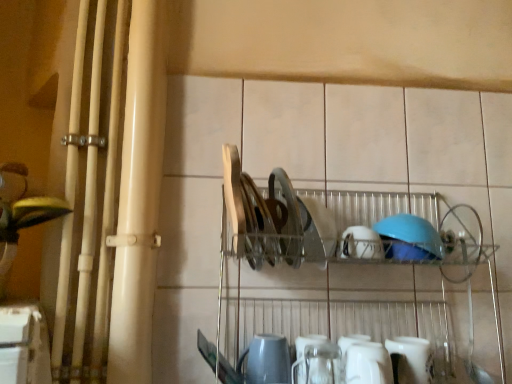
Question: From a real-world perspective, is white matte bowl at center, the second tableware when ordered from right to left, over metallic silver dish rack at center?

Choices:
 (A) no
 (B) yes

Answer: (B)

Question: Is white matte bowl at center, acting as the 4th tableware starting from the bottom, taller than metallic silver dish rack at center?

Choices:
 (A) no
 (B) yes

Answer: (A)

Question: Is metallic silver dish rack at center surrounded by white matte bowl at center, the second tableware when ordered from right to left?

Choices:
 (A) no
 (B) yes

Answer: (A)

Question: Considering the relative positions of white matte bowl at center, acting as the 4th tableware starting from the bottom, and metallic silver dish rack at center in the image provided, is white matte bowl at center, acting as the 4th tableware starting from the bottom, to the right of metallic silver dish rack at center from the viewer's perspective?

Choices:
 (A) yes
 (B) no

Answer: (A)

Question: From the image's perspective, is white matte bowl at center, which appears as the first tableware when viewed from the top, on top of metallic silver dish rack at center?

Choices:
 (A) yes
 (B) no

Answer: (A)

Question: In terms of size, does matte gray kettle at lower center, which is the first tableware from left to right, appear bigger or smaller than white glossy mug at lower center, which is counted as the third tableware, starting from the bottom?

Choices:
 (A) big
 (B) small

Answer: (A)

Question: Do you think matte gray kettle at lower center, which is the first tableware from left to right, is within white glossy mug at lower center, which is counted as the third tableware, starting from the bottom, or outside of it?

Choices:
 (A) inside
 (B) outside

Answer: (B)

Question: From a real-world perspective, is matte gray kettle at lower center, the third tableware positioned from the top, above or below white glossy mug at lower center, the second tableware positioned from the top?

Choices:
 (A) below
 (B) above

Answer: (A)

Question: In the image, is matte gray kettle at lower center, the second tableware when ordered from bottom to top, on the left side or the right side of white glossy mug at lower center, which is the second tableware in left-to-right order?

Choices:
 (A) left
 (B) right

Answer: (A)

Question: From a real-world perspective, relative to white glossy mug at lower center, which is the fourth tableware from top to bottom, is matte gray kettle at lower center, the fourth tableware in the right-to-left sequence, vertically above or below?

Choices:
 (A) above
 (B) below

Answer: (A)

Question: Considering the positions of matte gray kettle at lower center, the second tableware when ordered from bottom to top, and white glossy mug at lower center, the 1th tableware viewed from the right, in the image, is matte gray kettle at lower center, the second tableware when ordered from bottom to top, wider or thinner than white glossy mug at lower center, the 1th tableware viewed from the right,?

Choices:
 (A) thin
 (B) wide

Answer: (B)

Question: Based on their positions, is matte gray kettle at lower center, which is the first tableware from left to right, located to the left or right of white glossy mug at lower center, which is the fourth tableware from left to right?

Choices:
 (A) right
 (B) left

Answer: (B)

Question: Is point (263, 339) positioned closer to the camera than point (402, 365)?

Choices:
 (A) closer
 (B) farther

Answer: (B)

Question: Which is correct: white glossy mug at lower center, the second tableware positioned from the top, is inside white glossy mug at lower center, the first tableware in the bottom-to-top sequence, or outside of it?

Choices:
 (A) inside
 (B) outside

Answer: (B)

Question: From a real-world perspective, is white glossy mug at lower center, the second tableware positioned from the top, positioned above or below white glossy mug at lower center, the 1th tableware viewed from the right?

Choices:
 (A) above
 (B) below

Answer: (A)